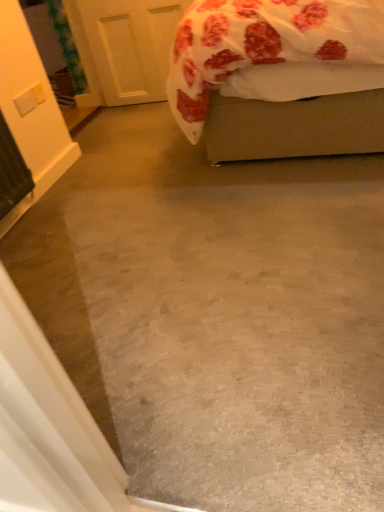
I want to click on free space in front of fluffy white bed at upper right, so click(246, 254).